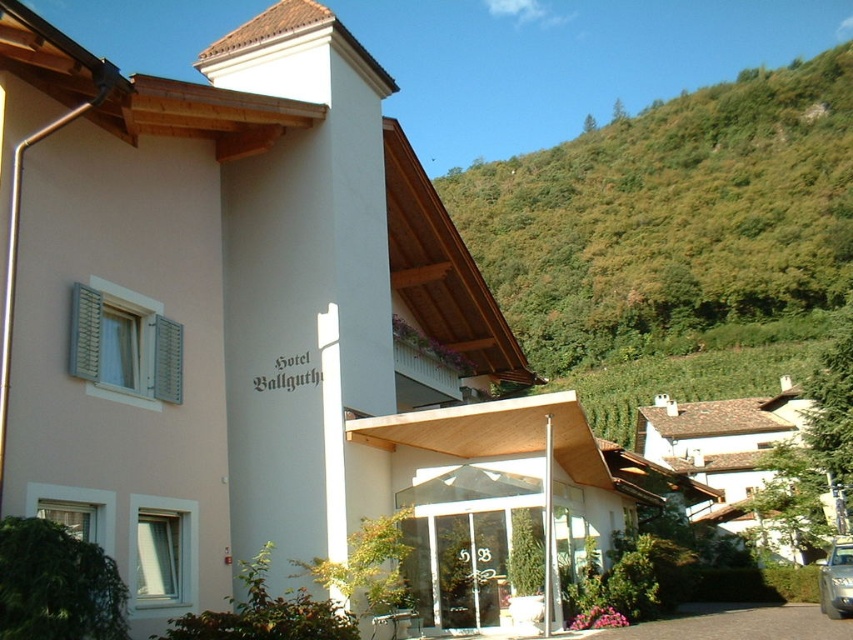
You are standing at a certain distance from the white stucco house at center. If you want to take a photo that captures the entire building without zooming in, would you need to move closer or farther away?

The white stucco house at center is 33.51 meters away from the viewer. To capture the entire building without zooming in, you would need to move farther away to ensure the entire structure fits in the frame.

You are standing in front of the Hotel Ballguth and want to park your car. The white stucco house at center is in the way. Can you park your silver metallic car at lower right behind it?

The white stucco house at center is located above the silver metallic car at lower right, so yes, you can park the silver metallic car at lower right behind the white stucco house at center since it is positioned below it.